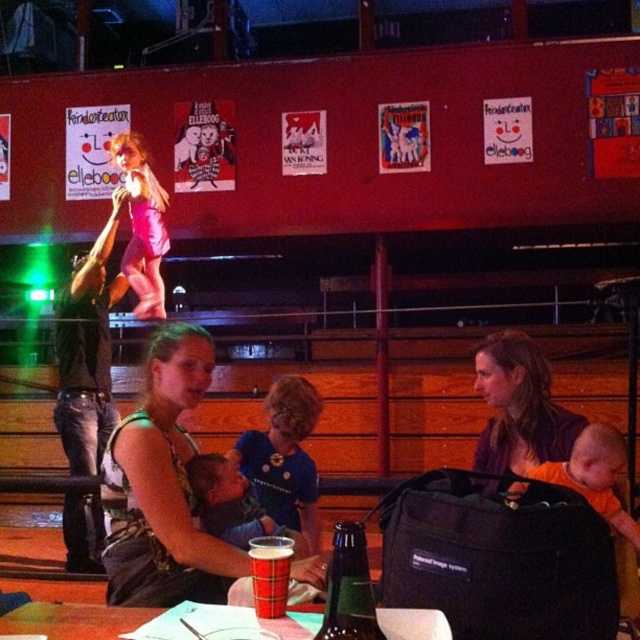
Is matte purple tank top at center above plaid paper cup at table center?

Correct, matte purple tank top at center is located above plaid paper cup at table center.

Who is lower down, matte purple tank top at center or plaid paper cup at table center?

plaid paper cup at table center is lower down.

I want to click on matte purple tank top at center, so click(518, 406).

Does green glass bottle at center have a greater height compared to plaid paper cup at table center?

Yes.

Does point (374, 620) come closer to viewer compared to point (278, 592)?

Yes.

This screenshot has height=640, width=640. Identify the location of green glass bottle at center. (348, 588).

Which is above, camouflage fabric baby carrier at center or matte plastic cup at center?

camouflage fabric baby carrier at center

Does camouflage fabric baby carrier at center appear on the right side of matte plastic cup at center?

Incorrect, camouflage fabric baby carrier at center is not on the right side of matte plastic cup at center.

Does point (202, 545) lie behind point (129, 618)?

Yes, point (202, 545) is farther from viewer.

In order to click on camouflage fabric baby carrier at center in this screenshot , I will do `click(163, 486)`.